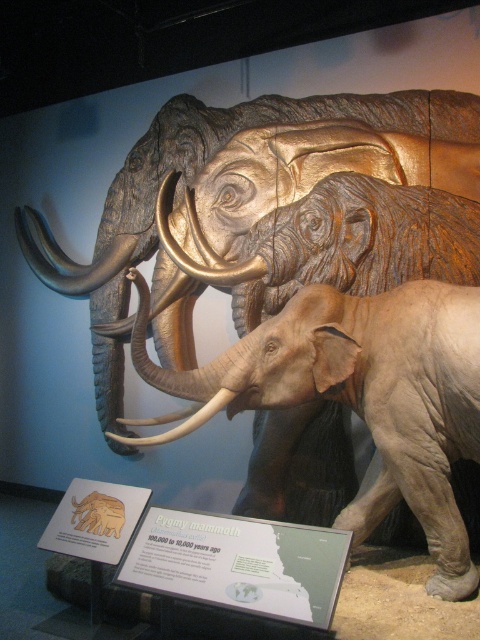
Question: In this image, where is matte gray elephant at center located relative to white ivory tusk at center?

Choices:
 (A) right
 (B) left

Answer: (A)

Question: Considering the relative positions of matte gray elephant at center and white ivory tusk at center in the image provided, where is matte gray elephant at center located with respect to white ivory tusk at center?

Choices:
 (A) above
 (B) below

Answer: (A)

Question: Which of the following is the closest to the observer?

Choices:
 (A) (225, 401)
 (B) (248, 330)

Answer: (A)

Question: Does matte gray elephant at center appear on the right side of white ivory tusk at center?

Choices:
 (A) yes
 (B) no

Answer: (A)

Question: Which of the following is the farthest from the observer?

Choices:
 (A) white ivory tusk at center
 (B) matte gray elephant at center

Answer: (B)